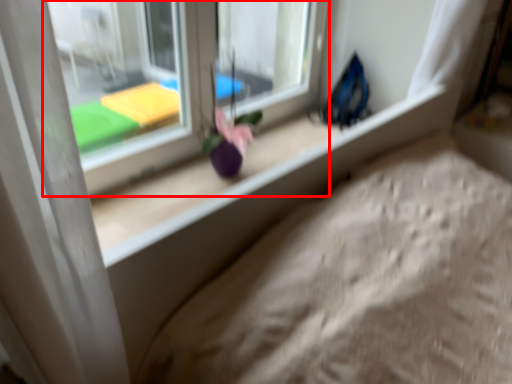
Question: Observing the image, what is the correct spatial positioning of window (annotated by the red box) in reference to flower?

Choices:
 (A) left
 (B) right

Answer: (A)